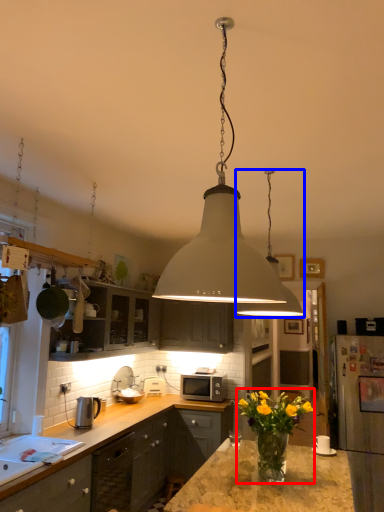
Question: Which of the following is the closest to the observer, floral arrangement (highlighted by a red box) or lamp (highlighted by a blue box)?

Choices:
 (A) floral arrangement
 (B) lamp

Answer: (A)